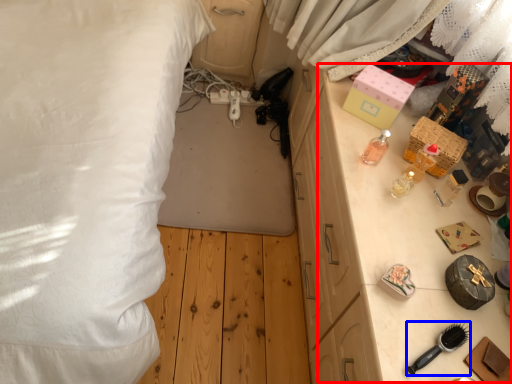
Question: Which object appears closest to the camera in this image, table (highlighted by a red box) or brush (highlighted by a blue box)?

Choices:
 (A) table
 (B) brush

Answer: (B)